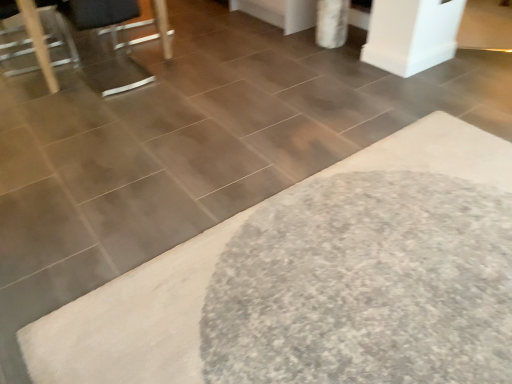
What is the approximate width of metallic silver chair at left?

metallic silver chair at left is 22.58 inches wide.

Describe the element at coordinates (94, 18) in the screenshot. I see `metallic silver swivel chair at upper left` at that location.

You are a GUI agent. You are given a task and a screenshot of the screen. Output one action in this format:
    pyautogui.click(x=<x>, y=<y>)
    Task: Click on the white shaggy bath mat at lower right
    This screenshot has height=384, width=512.
    Given the screenshot: What is the action you would take?
    pyautogui.click(x=216, y=269)

Which is correct: metallic silver chair at left is inside white shaggy bath mat at lower right, or outside of it?

metallic silver chair at left is not inside white shaggy bath mat at lower right, it's outside.

Considering the sizes of objects metallic silver chair at left and white shaggy bath mat at lower right in the image provided, who is bigger, metallic silver chair at left or white shaggy bath mat at lower right?

With larger size is white shaggy bath mat at lower right.

Could you tell me if metallic silver chair at left is facing white shaggy bath mat at lower right?

Yes, metallic silver chair at left is aimed at white shaggy bath mat at lower right.

From the image's perspective, is metallic silver swivel chair at upper left positioned above or below white shaggy bath mat at lower right?

metallic silver swivel chair at upper left is below white shaggy bath mat at lower right.

Which of these two, metallic silver swivel chair at upper left or white shaggy bath mat at lower right, is smaller?

metallic silver swivel chair at upper left is smaller.

Which of these two, metallic silver chair at left or metallic silver swivel chair at upper left, is wider?

metallic silver swivel chair at upper left.

Is metallic silver swivel chair at upper left a part of metallic silver chair at left?

No, metallic silver swivel chair at upper left is not inside metallic silver chair at left.

Based on the photo, who is bigger, metallic silver chair at left or metallic silver swivel chair at upper left?

With larger size is metallic silver swivel chair at upper left.

The width and height of the screenshot is (512, 384). In order to click on swivel chair that appears below the metallic silver chair at left (from the image's perspective) in this screenshot , I will do `click(94, 18)`.

Based on their positions, is white shaggy bath mat at lower right located to the left or right of metallic silver swivel chair at upper left?

white shaggy bath mat at lower right is to the right of metallic silver swivel chair at upper left.

Which object is closer to the camera, white shaggy bath mat at lower right or metallic silver swivel chair at upper left?

white shaggy bath mat at lower right is more forward.

Find the location of a particular element. This screenshot has width=512, height=384. swivel chair to the left of white shaggy bath mat at lower right is located at coordinates (94, 18).

Considering the relative sizes of white shaggy bath mat at lower right and metallic silver swivel chair at upper left in the image provided, is white shaggy bath mat at lower right smaller than metallic silver swivel chair at upper left?

Incorrect, white shaggy bath mat at lower right is not smaller in size than metallic silver swivel chair at upper left.

Measure the distance from white shaggy bath mat at lower right to metallic silver chair at left.

white shaggy bath mat at lower right and metallic silver chair at left are 2.08 meters apart.

Is white shaggy bath mat at lower right completely or partially outside of metallic silver chair at left?

That's correct, white shaggy bath mat at lower right is outside of metallic silver chair at left.

Is white shaggy bath mat at lower right taller or shorter than metallic silver chair at left?

In the image, white shaggy bath mat at lower right appears to be shorter than metallic silver chair at left.

From the image's perspective, which object appears higher, white shaggy bath mat at lower right or metallic silver chair at left?

metallic silver chair at left appears higher in the image.

Can you confirm if metallic silver swivel chair at upper left is thinner than metallic silver chair at left?

No.

From a real-world perspective, between metallic silver swivel chair at upper left and metallic silver chair at left, who is vertically higher?

metallic silver swivel chair at upper left is physically above.

Is point (63, 23) in front of point (44, 48)?

That is False.

At what (x,y) coordinates should I click in order to perform the action: click on bath mat lying in front of the metallic silver chair at left. Please return your answer as a coordinate pair (x, y). The width and height of the screenshot is (512, 384). Looking at the image, I should click on (216, 269).

In the image, there is a metallic silver swivel chair at upper left. At what (x,y) coordinates should I click in order to perform the action: click on bath mat above it (from the image's perspective). Please return your answer as a coordinate pair (x, y). This screenshot has width=512, height=384. Looking at the image, I should click on (216, 269).

Which object lies further to the anchor point white shaggy bath mat at lower right, metallic silver chair at left or metallic silver swivel chair at upper left?

Among the two, metallic silver chair at left is located further to white shaggy bath mat at lower right.

Looking at the image, which one is located closer to metallic silver swivel chair at upper left, white shaggy bath mat at lower right or metallic silver chair at left?

metallic silver chair at left.

Looking at the image, which one is located closer to metallic silver chair at left, white shaggy bath mat at lower right or metallic silver swivel chair at upper left?

metallic silver swivel chair at upper left is closer to metallic silver chair at left.

Based on their spatial positions, is metallic silver chair at left or white shaggy bath mat at lower right further from metallic silver swivel chair at upper left?

white shaggy bath mat at lower right.

When comparing their distances from white shaggy bath mat at lower right, does metallic silver swivel chair at upper left or metallic silver chair at left seem further?

metallic silver chair at left is positioned further to the anchor white shaggy bath mat at lower right.

Which object lies further to the anchor point metallic silver chair at left, metallic silver swivel chair at upper left or white shaggy bath mat at lower right?

white shaggy bath mat at lower right.

Locate an element on the screen. swivel chair between white shaggy bath mat at lower right and metallic silver chair at left from front to back is located at coordinates (94, 18).